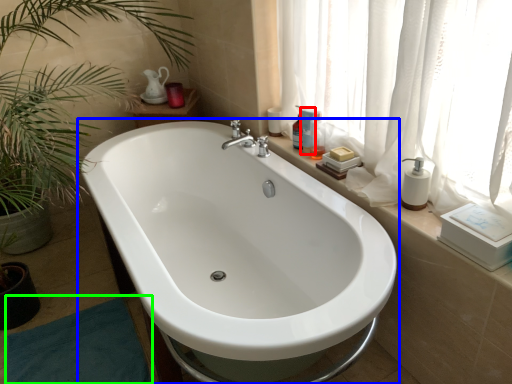
Question: Which is nearer to the toiletry (highlighted by a red box)? bathtub (highlighted by a blue box) or bath mat (highlighted by a green box).

Choices:
 (A) bathtub
 (B) bath mat

Answer: (A)